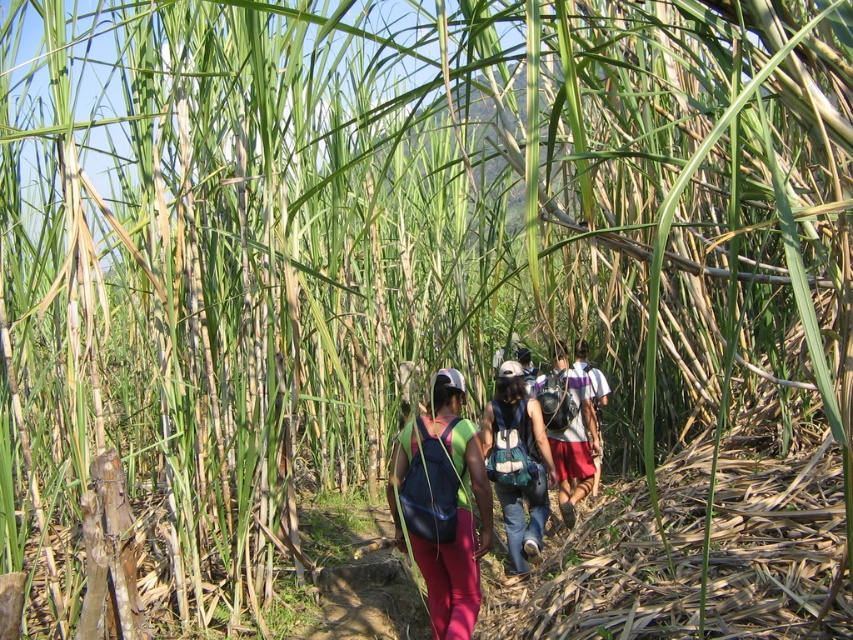
Question: Observing the image, what is the correct spatial positioning of denim backpack at center in reference to white cotton shirt at center?

Choices:
 (A) right
 (B) left

Answer: (B)

Question: Which object is the farthest from the white cotton shirt at center?

Choices:
 (A) denim backpack at center
 (B) matte blue backpack at center

Answer: (B)

Question: Considering the real-world distances, which object is closest to the denim backpack at center?

Choices:
 (A) matte blue backpack at center
 (B) white cotton shirt at center

Answer: (B)

Question: Does white cotton shirt at center appear on the right side of matte purple backpack at center?

Choices:
 (A) no
 (B) yes

Answer: (A)

Question: Can you confirm if matte blue backpack at center is positioned to the right of denim backpack at center?

Choices:
 (A) no
 (B) yes

Answer: (A)

Question: Which object is the closest to the denim backpack at center?

Choices:
 (A) matte blue backpack at center
 (B) white cotton shirt at center
 (C) matte purple backpack at center

Answer: (B)